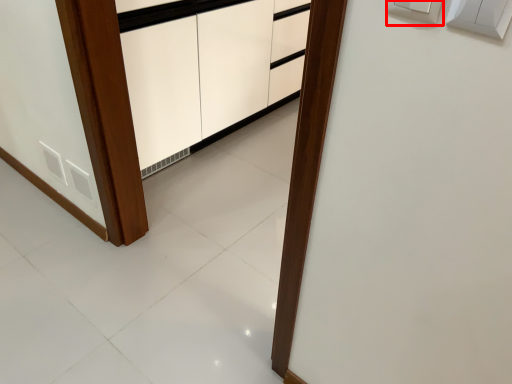
Question: From the image, what is the correct spatial relationship of electric outlet (annotated by the red box) in relation to light switch?

Choices:
 (A) right
 (B) left

Answer: (B)